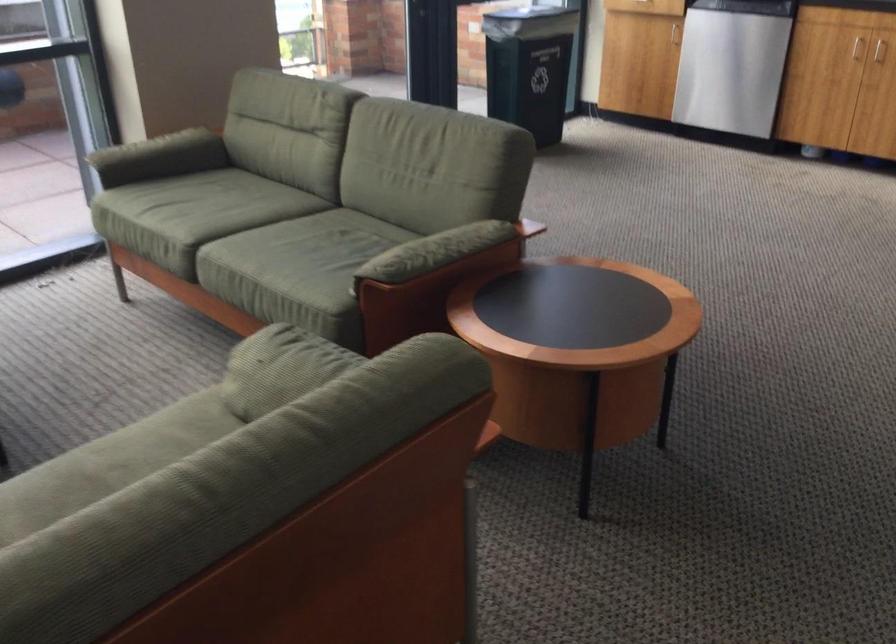
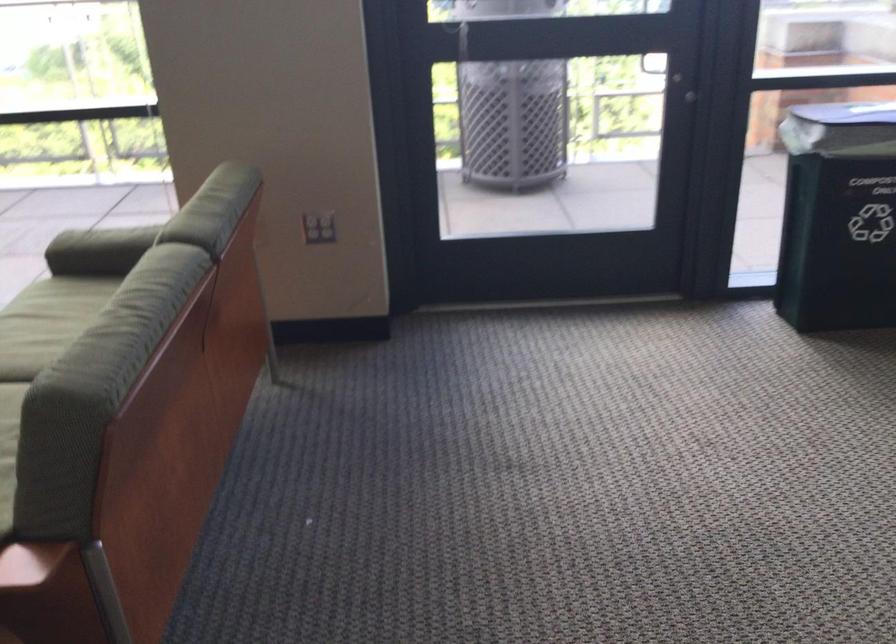
Find the pixel in the second image that matches the point at 126,175 in the first image.

(99, 247)